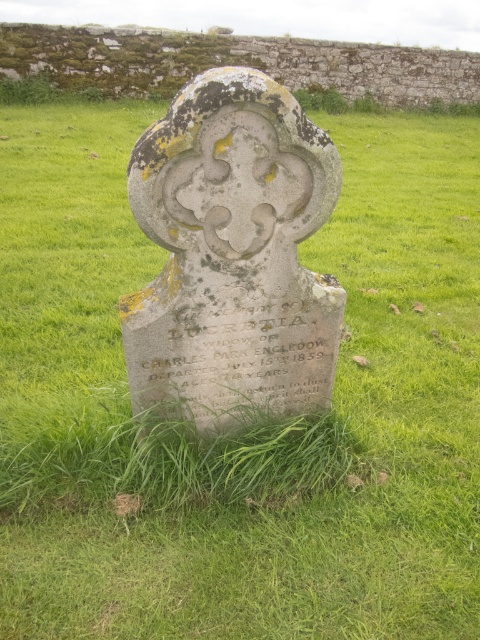
Question: Which object is closer to the camera taking this photo?

Choices:
 (A) gray stone gravestone at center
 (B) smooth gray stone at center

Answer: (A)

Question: Is gray stone gravestone at center wider than smooth gray stone at center?

Choices:
 (A) yes
 (B) no

Answer: (A)

Question: Does gray stone gravestone at center have a greater width compared to smooth gray stone at center?

Choices:
 (A) no
 (B) yes

Answer: (B)

Question: Which point is closer to the camera taking this photo?

Choices:
 (A) (92, 65)
 (B) (228, 260)

Answer: (B)

Question: Which point is closer to the camera taking this photo?

Choices:
 (A) (299, 52)
 (B) (132, 356)

Answer: (B)

Question: Does gray stone gravestone at center have a larger size compared to smooth gray stone at center?

Choices:
 (A) yes
 (B) no

Answer: (A)